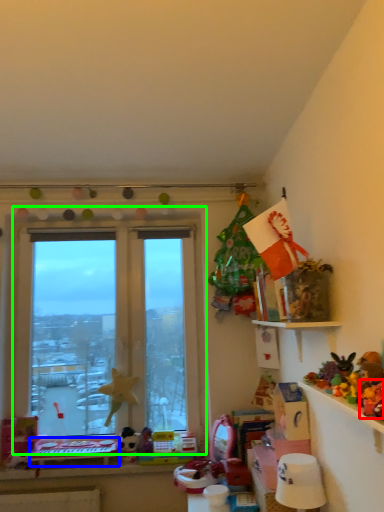
Question: Considering the real-world distances, which object is closest to toy (highlighted by a red box)? table (highlighted by a blue box) or window (highlighted by a green box).

Choices:
 (A) table
 (B) window

Answer: (A)